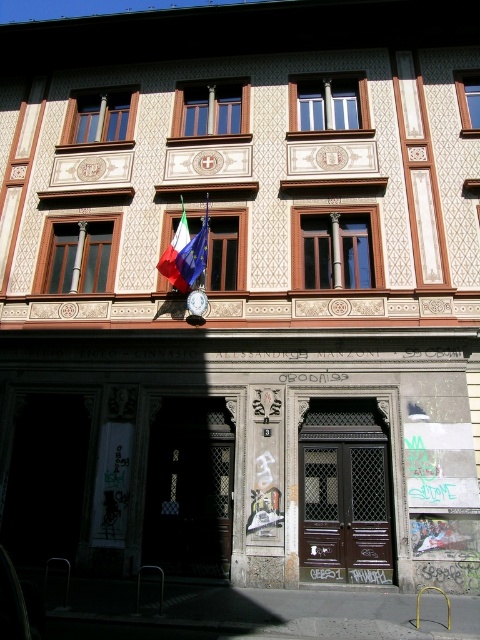
You are standing at the entrance of the LICEO building and want to clean the brown wood window at upper left. Given that your ladder can reach up to 50 feet, will it be sufficient to reach the window?

The distance of brown wood window at upper left from camera is 50.46 feet, which is slightly beyond the ladder capacity of 50 feet. Therefore, the ladder will not be sufficient to reach the window.

You are an architect designing a new building inspired by classical architecture. You need to ensure that the brown wood window at upper left and the polished metallic flag at center are proportionally balanced. Based on the existing building, which object should be adjusted in width to achieve this balance?

The brown wood window at upper left might be wider than the polished metallic flag at center, so to achieve proportional balance, the flag should be widened or the window narrowed to match the desired proportions.

You are an architect evaluating the facade of a school building. You notice the brown wood window at upper left and the wooden frame at upper center. Which of these two elements has a greater surface area?

The brown wood window at upper left has a greater surface area than the wooden frame at upper center because it is larger in size.